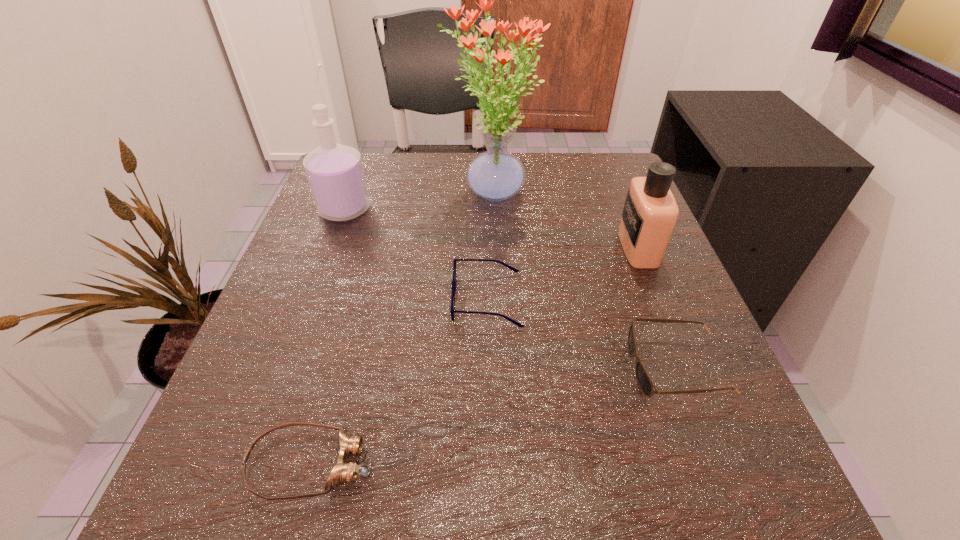
The height and width of the screenshot is (540, 960). Find the location of `vacant region located on the right of the fifth shortest object`. vacant region located on the right of the fifth shortest object is located at coordinates [402, 210].

Identify the location of blank space located on the front label of the fourth shortest object. (570, 247).

Where is `vacant region located on the front label of the fourth shortest object`? The image size is (960, 540). vacant region located on the front label of the fourth shortest object is located at coordinates (535, 247).

Find the location of a particular element. The width and height of the screenshot is (960, 540). vacant space situated 0.270m on the front label of the fourth shortest object is located at coordinates click(x=484, y=247).

Where is `vacant space located on the front-facing side of the third nearest object`? vacant space located on the front-facing side of the third nearest object is located at coordinates (343, 300).

In order to click on free point located 0.160m on the front-facing side of the third nearest object in this screenshot , I will do `click(360, 300)`.

Identify the location of vacant space located 0.210m on the front-facing side of the third nearest object. (331, 300).

Identify the location of free space located on the lenses of the fifth farthest object. This screenshot has width=960, height=540. (578, 367).

Where is `free location located on the lenses of the fifth farthest object`? The height and width of the screenshot is (540, 960). free location located on the lenses of the fifth farthest object is located at coordinates (438, 367).

Find the location of a particular element. The height and width of the screenshot is (540, 960). free region located 0.140m on the lenses of the fifth farthest object is located at coordinates (538, 367).